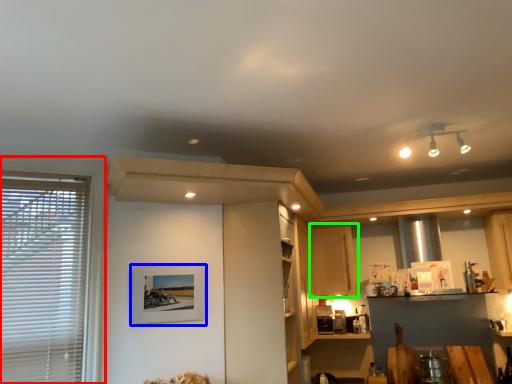
Question: Which object is the farthest from window (highlighted by a red box)? Choose among these: picture frame (highlighted by a blue box) or cabinetry (highlighted by a green box).

Choices:
 (A) picture frame
 (B) cabinetry

Answer: (B)